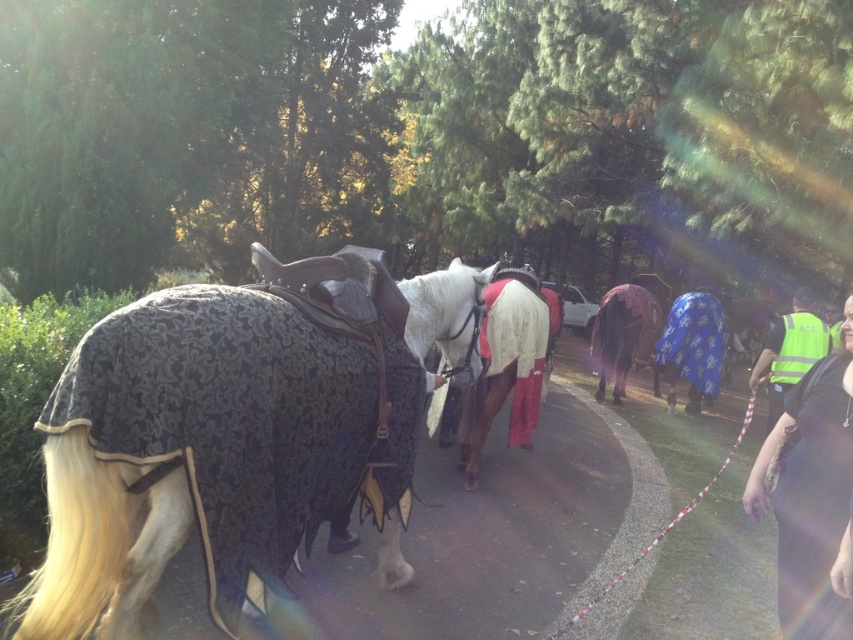
You are a park ranger inspecting the horses in the scene. You notice the black textured blanket at left and the reflective yellow vest at right. Which item is covering the other?

The black textured blanket at left is positioned over the reflective yellow vest at right, meaning the blanket is covering the vest.

You are a rider preparing to mount your horse. You see the blue patterned blanket at center and the dark brown fabric horse at center. Which object is located to the right of the other?

The blue patterned blanket at center is positioned on the right side of dark brown fabric horse at center, so the blue patterned blanket at center is to the right of the dark brown fabric horse at center.